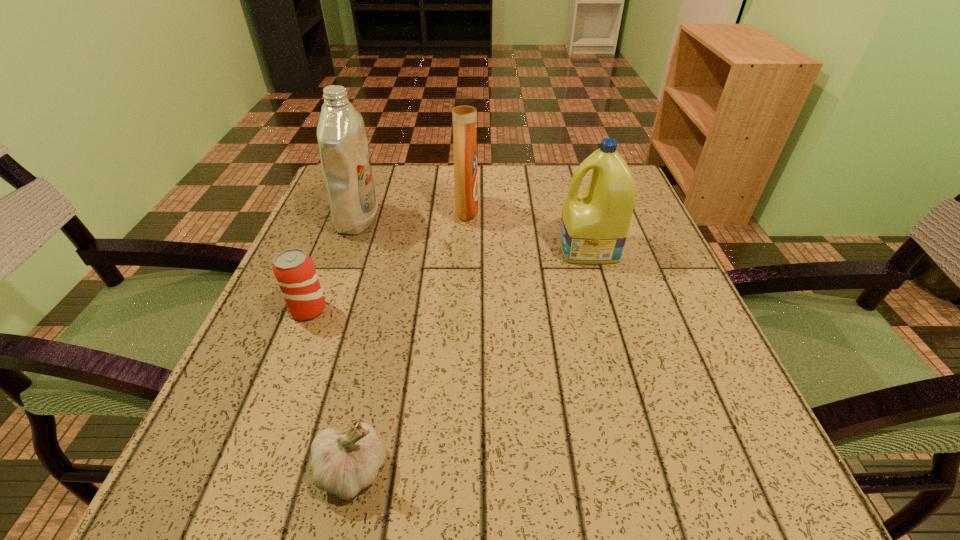
Locate an element on the screen. vacant space located on the label of the rightmost object is located at coordinates (436, 248).

Find the location of a particular element. The width and height of the screenshot is (960, 540). vacant space located on the right of the beer can is located at coordinates (395, 310).

Identify the location of free space located 0.160m on the right of the third object from right to left. This screenshot has height=540, width=960. (515, 470).

This screenshot has height=540, width=960. What are the coordinates of `object situated at the near edge` in the screenshot? It's located at (343, 465).

The width and height of the screenshot is (960, 540). What are the coordinates of `detergent at the left edge` in the screenshot? It's located at (345, 159).

Locate an element on the screen. beer can situated at the left edge is located at coordinates (294, 270).

Image resolution: width=960 pixels, height=540 pixels. Find the location of `garlic that is positioned at the left edge`. garlic that is positioned at the left edge is located at coordinates (343, 465).

Where is `object at the right edge`? object at the right edge is located at coordinates (595, 221).

Where is `object that is at the far left corner`? The height and width of the screenshot is (540, 960). object that is at the far left corner is located at coordinates (345, 159).

Locate an element on the screen. object that is at the near left corner is located at coordinates (343, 465).